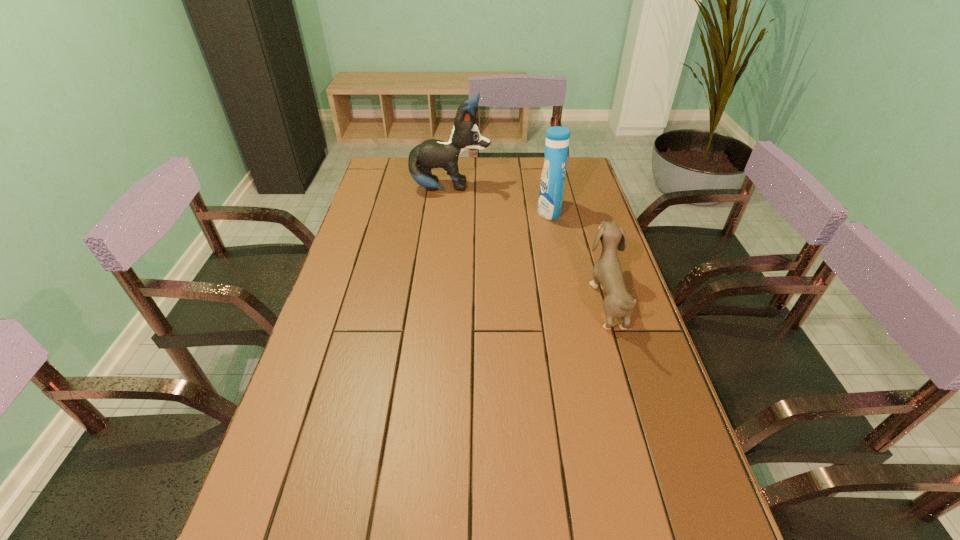
The image size is (960, 540). In order to click on free space located at the face of the nearer puppy in this screenshot , I will do `click(482, 300)`.

You are a GUI agent. You are given a task and a screenshot of the screen. Output one action in this format:
    pyautogui.click(x=<x>, y=<y>)
    Task: Click on the blank space located at the face of the nearer puppy
    The image size is (960, 540).
    Given the screenshot: What is the action you would take?
    pyautogui.click(x=453, y=300)

Where is `vacant space located at the face of the nearer puppy`? The width and height of the screenshot is (960, 540). vacant space located at the face of the nearer puppy is located at coordinates (515, 300).

Identify the location of object located at the far edge. Image resolution: width=960 pixels, height=540 pixels. (432, 153).

You are a GUI agent. You are given a task and a screenshot of the screen. Output one action in this format:
    pyautogui.click(x=<x>, y=<y>)
    Task: Click on the detergent present at the right edge
    
    Given the screenshot: What is the action you would take?
    pyautogui.click(x=552, y=183)

At what (x,y) coordinates should I click in order to perform the action: click on puppy present at the right edge. Please return your answer as a coordinate pair (x, y). The image size is (960, 540). Looking at the image, I should click on [x=607, y=271].

Identify the location of free space at the left edge. Image resolution: width=960 pixels, height=540 pixels. (360, 239).

You are a GUI agent. You are given a task and a screenshot of the screen. Output one action in this format:
    pyautogui.click(x=<x>, y=<y>)
    Task: Click on the vacant space at the right edge of the desktop
    
    Given the screenshot: What is the action you would take?
    pyautogui.click(x=594, y=237)

The width and height of the screenshot is (960, 540). Identify the location of vacant space at the far left corner. (401, 158).

Locate an element on the screen. free space at the far right corner of the desktop is located at coordinates (586, 176).